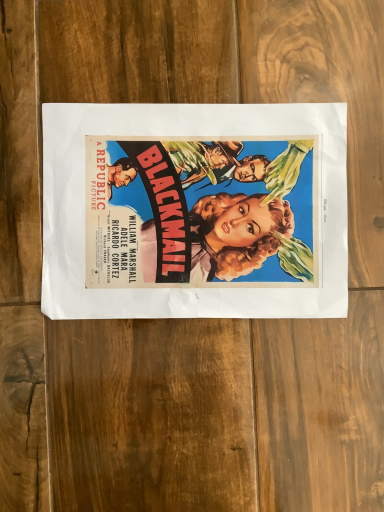
What is the approximate width of matte paper poster at center?

12.10 inches.

At what (x,y) coordinates should I click in order to perform the action: click on matte paper poster at center. Please return your answer as a coordinate pair (x, y). This screenshot has height=512, width=384. Looking at the image, I should click on (194, 211).

The height and width of the screenshot is (512, 384). Describe the element at coordinates (194, 211) in the screenshot. I see `matte paper poster at center` at that location.

Measure the distance between matte paper poster at center and camera.

The distance of matte paper poster at center from camera is 40.66 centimeters.

I want to click on matte paper poster at center, so click(194, 211).